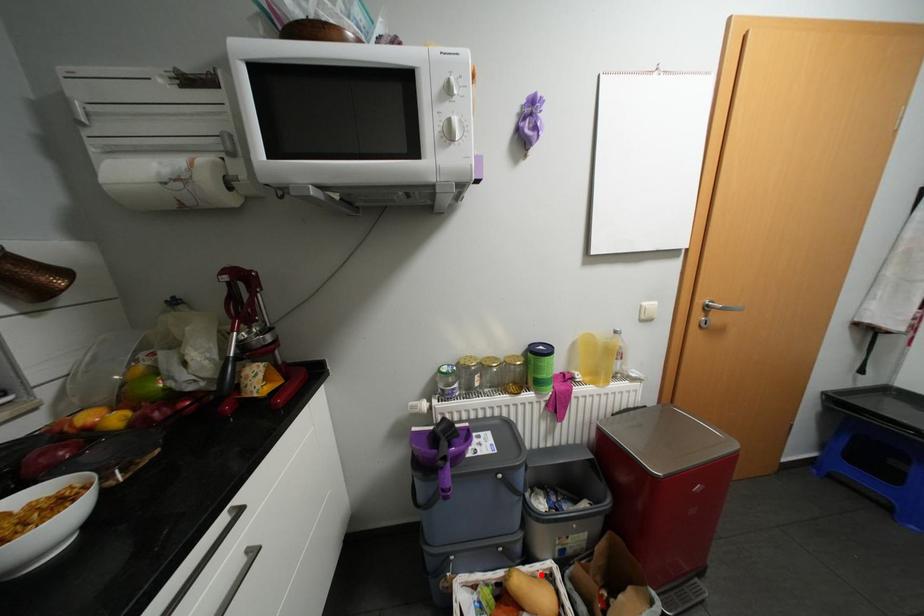
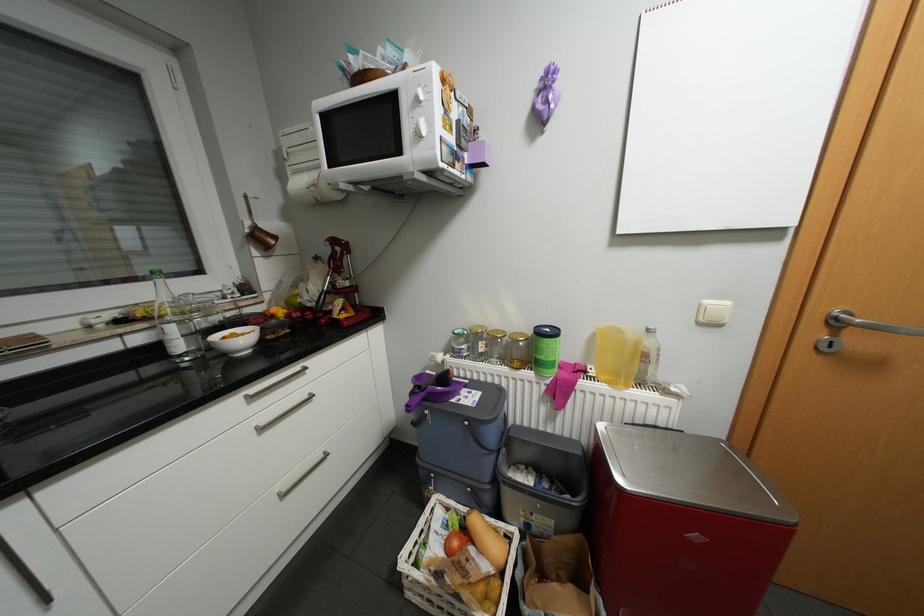
Question: I am providing you with two images of the same scene from different viewpoints. A red point is shown in image1. For the corresponding object point in image2, is it positioned nearer or farther from the camera?

Choices:
 (A) Nearer
 (B) Farther

Answer: (B)